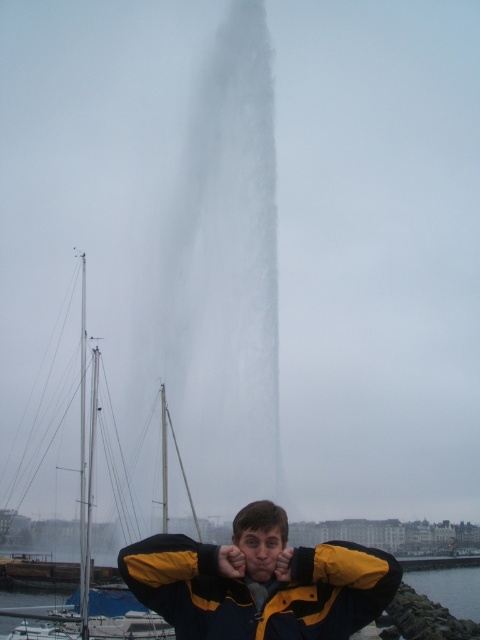
Question: Is matte black hand at center above yellow matte hand at center?

Choices:
 (A) yes
 (B) no

Answer: (A)

Question: Is white matte sailboat at left in front of white frothy water at center?

Choices:
 (A) no
 (B) yes

Answer: (B)

Question: Which point is farther to the camera?

Choices:
 (A) white matte sailboat at left
 (B) matte black hand at center

Answer: (A)

Question: Estimate the real-world distances between objects in this image. Which object is closer to the clear water at lower right?

Choices:
 (A) yellow/black jacket at center
 (B) white frothy water at center

Answer: (B)

Question: Which point appears closest to the camera in this image?

Choices:
 (A) (225, 566)
 (B) (382, 625)
 (C) (223, 588)
 (D) (453, 582)

Answer: (A)

Question: Is matte black hand at center positioned before yellow matte hand at center?

Choices:
 (A) no
 (B) yes

Answer: (B)